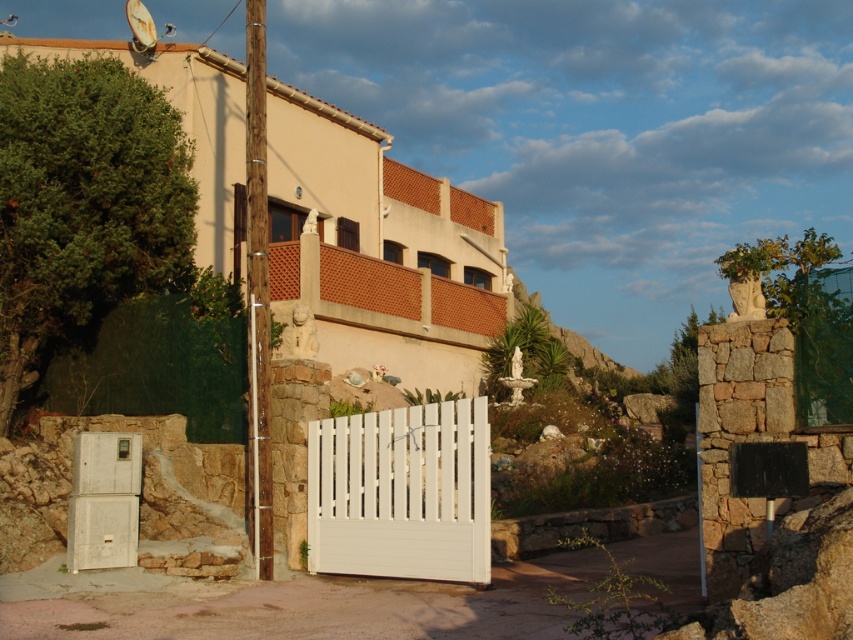
Is white painted wood gate at center positioned behind white matte refrigerator at lower left?

No, it is not.

Between white painted wood gate at center and white matte refrigerator at lower left, which one appears on the left side from the viewer's perspective?

Positioned to the left is white matte refrigerator at lower left.

Locate an element on the screen. The height and width of the screenshot is (640, 853). white painted wood gate at center is located at coordinates (401, 492).

Image resolution: width=853 pixels, height=640 pixels. Find the location of `white painted wood gate at center`. white painted wood gate at center is located at coordinates (401, 492).